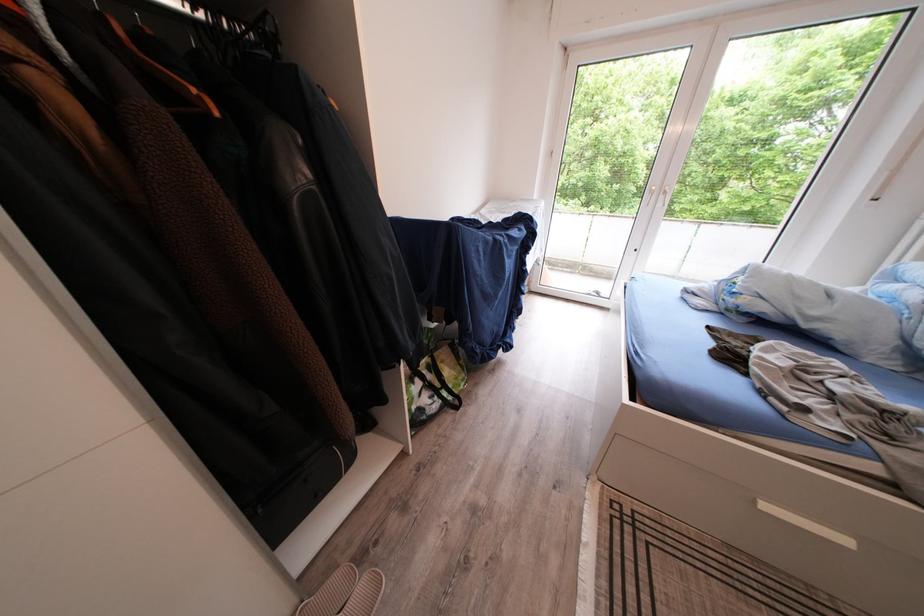
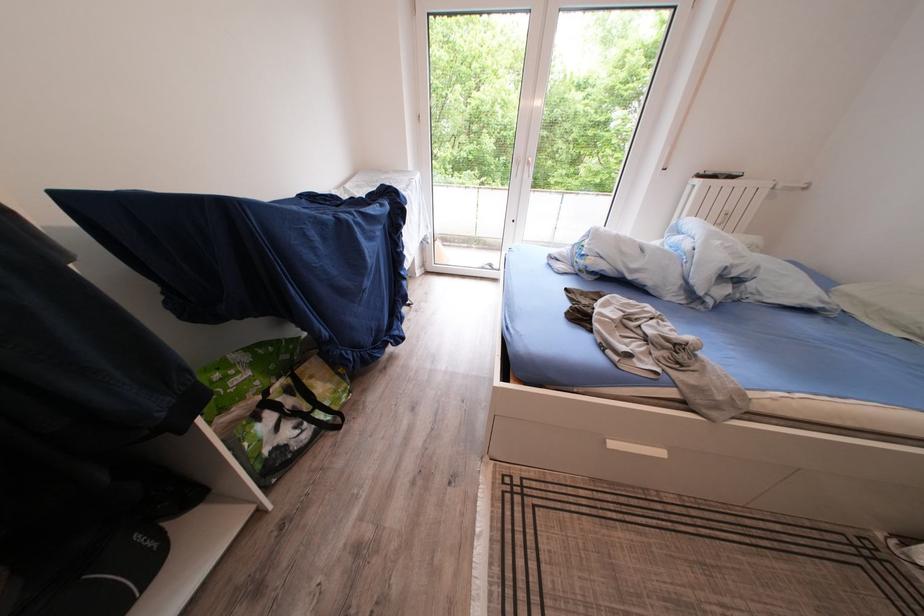
Question: Based on the continuous images, in which direction is the camera rotating? Reply with the corresponding letter.

Choices:
 (A) Left
 (B) Right
 (C) Up
 (D) Down

Answer: (B)